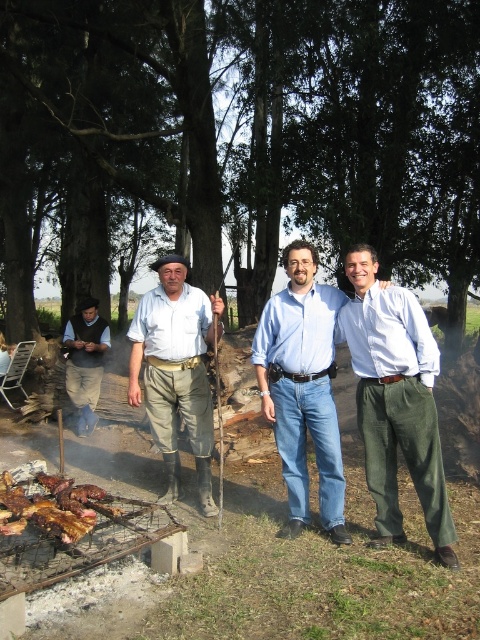
Measure the distance between matte blue shirt at center and light brown leather vest at left.

4.38 meters

What do you see at coordinates (302, 387) in the screenshot?
I see `matte blue shirt at center` at bounding box center [302, 387].

Where is `matte blue shirt at center`? matte blue shirt at center is located at coordinates (302, 387).

Who is higher up, matte blue shirt at center or brown charred meat at lower left?

matte blue shirt at center is higher up.

Is matte blue shirt at center wider than brown charred meat at lower left?

No, matte blue shirt at center is not wider than brown charred meat at lower left.

What do you see at coordinates (302, 387) in the screenshot? The height and width of the screenshot is (640, 480). I see `matte blue shirt at center` at bounding box center [302, 387].

Identify the location of matte blue shirt at center. The image size is (480, 640). (302, 387).

Is green cotton pants at right further to camera compared to matte blue shirt at center?

That is False.

Which is above, green cotton pants at right or matte blue shirt at center?

matte blue shirt at center

Does point (374, 253) come behind point (330, 392)?

That is False.

Identify the location of green cotton pants at right. This screenshot has height=640, width=480. (396, 401).